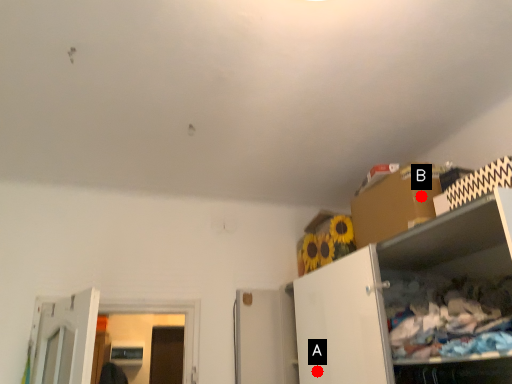
Question: Two points are circled on the image, labeled by A and B beside each circle. Which point is further to the camera?

Choices:
 (A) A is further
 (B) B is further

Answer: (A)